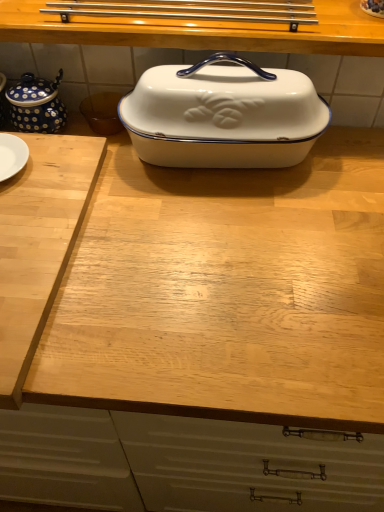
Question: Can you confirm if white enamel casserole dish at center is bigger than light wood cutting board at left?

Choices:
 (A) no
 (B) yes

Answer: (B)

Question: Can we say white enamel casserole dish at center lies outside light wood cutting board at left?

Choices:
 (A) no
 (B) yes

Answer: (B)

Question: From a real-world perspective, is white enamel casserole dish at center positioned over light wood cutting board at left based on gravity?

Choices:
 (A) no
 (B) yes

Answer: (B)

Question: Could you tell me if white enamel casserole dish at center is facing light wood cutting board at left?

Choices:
 (A) yes
 (B) no

Answer: (B)

Question: Are white enamel casserole dish at center and light wood cutting board at left located far from each other?

Choices:
 (A) yes
 (B) no

Answer: (B)

Question: Would you say light wood cutting board at left is inside or outside white enamel casserole dish at center?

Choices:
 (A) inside
 (B) outside

Answer: (B)

Question: Is light wood cutting board at left to the left or to the right of white enamel casserole dish at center in the image?

Choices:
 (A) left
 (B) right

Answer: (A)

Question: From the image's perspective, relative to white enamel casserole dish at center, is light wood cutting board at left above or below?

Choices:
 (A) below
 (B) above

Answer: (A)

Question: Is point (97, 146) positioned closer to the camera than point (226, 91)?

Choices:
 (A) farther
 (B) closer

Answer: (A)

Question: In terms of height, does white glossy enamel dish at center look taller or shorter compared to white enamel casserole dish at center?

Choices:
 (A) short
 (B) tall

Answer: (A)

Question: Is white glossy enamel dish at center inside or outside of white enamel casserole dish at center?

Choices:
 (A) inside
 (B) outside

Answer: (B)

Question: Is point (46, 33) positioned closer to the camera than point (201, 92)?

Choices:
 (A) farther
 (B) closer

Answer: (A)

Question: From the image's perspective, is white glossy enamel dish at center above or below white enamel casserole dish at center?

Choices:
 (A) below
 (B) above

Answer: (B)

Question: Is point [x=200, y=124] positioned closer to the camera than point [x=8, y=94]?

Choices:
 (A) farther
 (B) closer

Answer: (B)

Question: Considering the relative positions of white enamel casserole dish at center and blue dotted ceramic tea pot at left in the image provided, is white enamel casserole dish at center to the left or to the right of blue dotted ceramic tea pot at left?

Choices:
 (A) left
 (B) right

Answer: (B)